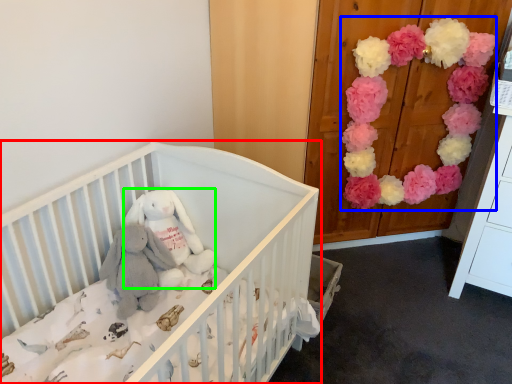
Question: Which object is the farthest from infant bed (highlighted by a red box)? Choose among these: flower (highlighted by a blue box) or toy (highlighted by a green box).

Choices:
 (A) flower
 (B) toy

Answer: (A)